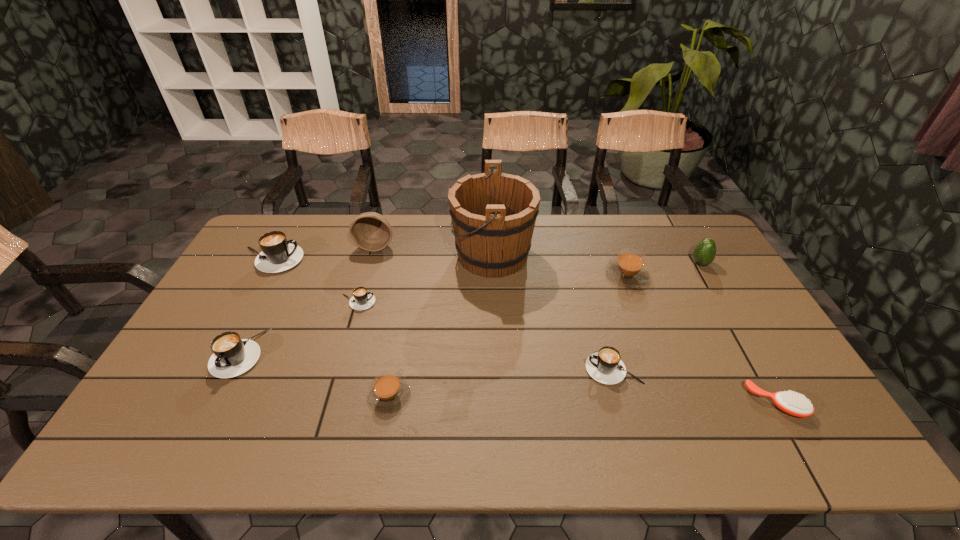
The image size is (960, 540). Find the location of `cappuccino positioned at the far edge`. cappuccino positioned at the far edge is located at coordinates (278, 254).

The width and height of the screenshot is (960, 540). Find the location of `avocado that is at the right edge`. avocado that is at the right edge is located at coordinates (704, 253).

Where is `hairbrush that is at the right edge`? The height and width of the screenshot is (540, 960). hairbrush that is at the right edge is located at coordinates (790, 402).

Image resolution: width=960 pixels, height=540 pixels. What are the coordinates of `object that is at the far left corner` in the screenshot? It's located at (278, 254).

The width and height of the screenshot is (960, 540). What are the coordinates of `free space at the far edge of the desktop` in the screenshot? It's located at (589, 229).

In the image, there is a desktop. What are the coordinates of `free space at the near edge` in the screenshot? It's located at (625, 443).

This screenshot has height=540, width=960. In order to click on blank space at the left edge of the desktop in this screenshot , I will do `click(189, 358)`.

In the image, there is a desktop. Where is `vacant space at the right edge`? vacant space at the right edge is located at coordinates (726, 270).

Where is `vacant space at the far right corner of the desktop`? This screenshot has width=960, height=540. vacant space at the far right corner of the desktop is located at coordinates (676, 224).

In the image, there is a desktop. Find the location of `vacant space at the near right corner`. vacant space at the near right corner is located at coordinates (814, 425).